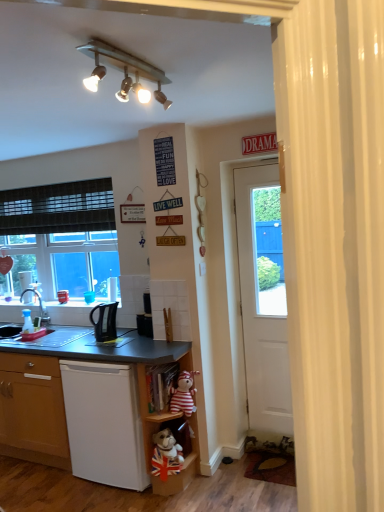
I want to click on striped fabric teddy bear at lower center, so click(x=183, y=394).

The width and height of the screenshot is (384, 512). What are the coordinates of `brown textured rug at lower right` in the screenshot? It's located at (271, 460).

Image resolution: width=384 pixels, height=512 pixels. What do you see at coordinates (156, 426) in the screenshot?
I see `wooden shelf at lower center, acting as the 1th shelf starting from the bottom` at bounding box center [156, 426].

In the scene shown: What is the approximate width of wooden shelf at lower center, the third shelf viewed from the top?

wooden shelf at lower center, the third shelf viewed from the top, is 8.50 inches in width.

What is the approximate height of white matte dishwasher at lower left?

The height of white matte dishwasher at lower left is 33.37 inches.

Find the location of a particular element. matte black desk at lower left is located at coordinates (82, 405).

Is translucent plastic coffee cup at left at the left side of striped fabric teddy bear at lower center?

Correct, you'll find translucent plastic coffee cup at left to the left of striped fabric teddy bear at lower center.

Is translucent plastic coffee cup at left oriented away from striped fabric teddy bear at lower center?

That's not correct — translucent plastic coffee cup at left is not looking away from striped fabric teddy bear at lower center.

Is striped fabric teddy bear at lower center inside translucent plastic coffee cup at left?

No, striped fabric teddy bear at lower center is not surrounded by translucent plastic coffee cup at left.

Image resolution: width=384 pixels, height=512 pixels. I want to click on coffee cup behind the striped fabric teddy bear at lower center, so click(89, 297).

Between black plastic kettle at lower left and metallic track lighting at upper center, which one appears on the left side from the viewer's perspective?

Positioned to the left is black plastic kettle at lower left.

Which is less distant, (x=103, y=323) or (x=126, y=83)?

Point (x=103, y=323) appears to be farther away from the viewer than point (x=126, y=83).

From a real-world perspective, which object rests below the other?

black plastic kettle at lower left, from a real-world perspective.

From a real-world perspective, which is physically below, matte black desk at lower left or black plastic kettle at lower left?

In real-world perspective, matte black desk at lower left is lower.

Is matte black desk at lower left in front of or behind black plastic kettle at lower left in the image?

Clearly, matte black desk at lower left is in front of black plastic kettle at lower left.

Which object is positioned more to the left, matte black desk at lower left or black plastic kettle at lower left?

black plastic kettle at lower left.

Measure the distance between matte black desk at lower left and black plastic kettle at lower left.

matte black desk at lower left and black plastic kettle at lower left are 21.86 inches apart.

Would you say metallic track lighting at upper center is part of translucent plastic coffee cup at left's contents?

No, translucent plastic coffee cup at left does not contain metallic track lighting at upper center.

Is translucent plastic coffee cup at left wider than metallic track lighting at upper center?

No, translucent plastic coffee cup at left is not wider than metallic track lighting at upper center.

Is translucent plastic coffee cup at left looking in the opposite direction of metallic track lighting at upper center?

translucent plastic coffee cup at left does not have its back to metallic track lighting at upper center.

From a real-world perspective, which is physically above, translucent plastic coffee cup at left or metallic track lighting at upper center?

From a 3D spatial view, metallic track lighting at upper center is above.

Would you say translucent plastic coffee cup at left is inside or outside wooden shelf at lower center, acting as the 1th shelf starting from the bottom?

translucent plastic coffee cup at left is not inside wooden shelf at lower center, acting as the 1th shelf starting from the bottom, it's outside.

From a real-world perspective, does translucent plastic coffee cup at left sit lower than wooden shelf at lower center, acting as the 1th shelf starting from the bottom?

No.

Based on the photo, measure the distance between translucent plastic coffee cup at left and wooden shelf at lower center, the third shelf viewed from the top.

translucent plastic coffee cup at left and wooden shelf at lower center, the third shelf viewed from the top, are 1.26 meters apart.

Which is more to the right, translucent plastic coffee cup at left or wooden shelf at lower center, the third shelf viewed from the top?

From the viewer's perspective, wooden shelf at lower center, the third shelf viewed from the top, appears more on the right side.

Is translucent plastic coffee cup at left not inside white matte door at right?

Yes, translucent plastic coffee cup at left is outside of white matte door at right.

The width and height of the screenshot is (384, 512). What are the coordinates of `door on the right of translucent plastic coffee cup at left` in the screenshot? It's located at (263, 298).

In the scene shown: Is translucent plastic coffee cup at left to the left of white matte door at right from the viewer's perspective?

Correct, you'll find translucent plastic coffee cup at left to the left of white matte door at right.

Is translucent plastic coffee cup at left turned away from white matte door at right?

translucent plastic coffee cup at left is not turned away from white matte door at right.

Identify the location of faucet on the left of the wooden shelf at lower center, the 2th shelf viewed from the top. This screenshot has height=512, width=384. (39, 306).

Is brushed metal faucet at left closer to the viewer compared to wooden shelf at lower center, arranged as the second shelf when ordered from the bottom?

No.

How many degrees apart are the facing directions of brushed metal faucet at left and wooden shelf at lower center, the 2th shelf viewed from the top?

The facing directions of brushed metal faucet at left and wooden shelf at lower center, the 2th shelf viewed from the top, are 2.48 degrees apart.

Considering the positions of points (27, 289) and (160, 481), is point (27, 289) farther from camera compared to point (160, 481)?

Yes, point (27, 289) is behind point (160, 481).

At what (x,y) coordinates should I click in order to perform the action: click on teddy bear on the right of translucent plastic coffee cup at left. Please return your answer as a coordinate pair (x, y). Image resolution: width=384 pixels, height=512 pixels. Looking at the image, I should click on pyautogui.click(x=183, y=394).

Locate an element on the screen. lamp in front of the black plastic kettle at lower left is located at coordinates (124, 72).

Considering their positions, is wooden shelf at lower center, the 2th shelf viewed from the top, positioned further to white matte door at right than wooden bookshelf at lower center, which ranks as the 3th shelf in bottom-to-top order?

The object further to white matte door at right is wooden bookshelf at lower center, which ranks as the 3th shelf in bottom-to-top order.

Looking at the image, which one is located closer to brushed metal faucet at left, brown textured rug at lower right or white matte dishwasher at lower left?

Based on the image, white matte dishwasher at lower left appears to be nearer to brushed metal faucet at left.

Looking at the image, which one is located closer to wooden shelf at lower center, arranged as the second shelf when ordered from the bottom, striped fabric teddy bear at lower center or black plastic kettle at lower left?

striped fabric teddy bear at lower center is closer to wooden shelf at lower center, arranged as the second shelf when ordered from the bottom.

Looking at this image, based on their spatial positions, is brushed metal faucet at left or wooden shelf at lower center, the third shelf viewed from the top, further from wooden shelf at lower center, arranged as the second shelf when ordered from the bottom?

Among the two, brushed metal faucet at left is located further to wooden shelf at lower center, arranged as the second shelf when ordered from the bottom.

From the image, which object appears to be farther from white matte door at right, striped fabric teddy bear at lower center or wooden shelf at lower center, the 2th shelf viewed from the top?

wooden shelf at lower center, the 2th shelf viewed from the top, is further to white matte door at right.

From the image, which object appears to be farther from black plastic kettle at lower left, metallic track lighting at upper center or translucent plastic coffee cup at left?

metallic track lighting at upper center.

Which object lies further to the anchor point translucent plastic coffee cup at left, white matte door at right or wooden shelf at lower center, the third shelf viewed from the top?

Among the two, white matte door at right is located further to translucent plastic coffee cup at left.

When comparing their distances from wooden bookshelf at lower center, which appears as the 1th shelf when viewed from the top, does brushed metal faucet at left or translucent plastic coffee cup at left seem closer?

Among the two, translucent plastic coffee cup at left is located nearer to wooden bookshelf at lower center, which appears as the 1th shelf when viewed from the top.

This screenshot has width=384, height=512. I want to click on corded phone between matte black sink at lower left, the second sink viewed from the right, and wooden shelf at lower center, the third shelf viewed from the top, from left to right, so click(104, 321).

I want to click on desk positioned between metallic track lighting at upper center and brushed metal faucet at left from near to far, so click(82, 405).

Locate an element on the screen. Image resolution: width=384 pixels, height=512 pixels. corded phone situated between brushed metal faucet at left and wooden shelf at lower center, the 2th shelf viewed from the top, from left to right is located at coordinates (104, 321).

You are a GUI agent. You are given a task and a screenshot of the screen. Output one action in this format:
    pyautogui.click(x=<x>, y=<y>)
    Task: Click on the teddy bear between black plastic kettle at lower left and brown textured rug at lower right
    This screenshot has height=512, width=384.
    Given the screenshot: What is the action you would take?
    pyautogui.click(x=183, y=394)